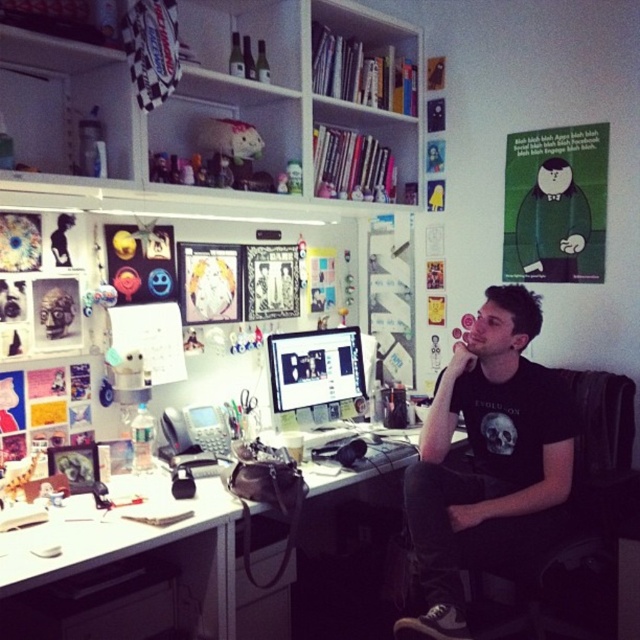
Question: Is white glossy computer desk at center wider than matte black monitor at center?

Choices:
 (A) no
 (B) yes

Answer: (B)

Question: Is white wooden bookshelf at upper center to the right of black fabric swivel chair at right from the viewer's perspective?

Choices:
 (A) yes
 (B) no

Answer: (B)

Question: Among these objects, which one is nearest to the camera?

Choices:
 (A) white glossy computer desk at center
 (B) black matte t-shirt at center

Answer: (A)

Question: Can you confirm if white glossy computer desk at center is smaller than white glossy desk at lower left?

Choices:
 (A) no
 (B) yes

Answer: (A)

Question: Which of the following is the farthest from the observer?

Choices:
 (A) black matte t-shirt at center
 (B) matte black monitor at center

Answer: (B)

Question: Among these objects, which one is nearest to the camera?

Choices:
 (A) white wooden bookshelf at upper center
 (B) white glossy computer desk at center

Answer: (B)